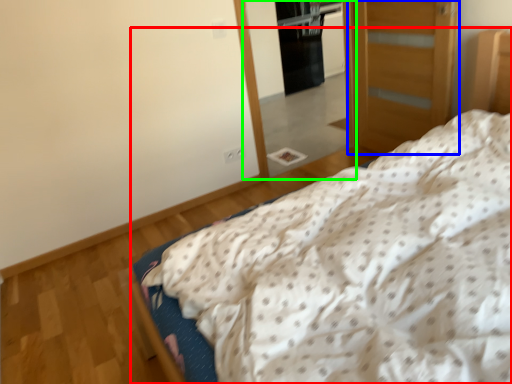
Question: Based on their relative distances, which object is nearer to bed (highlighted by a red box)? Choose from door (highlighted by a blue box) and mirror (highlighted by a green box).

Choices:
 (A) door
 (B) mirror

Answer: (A)